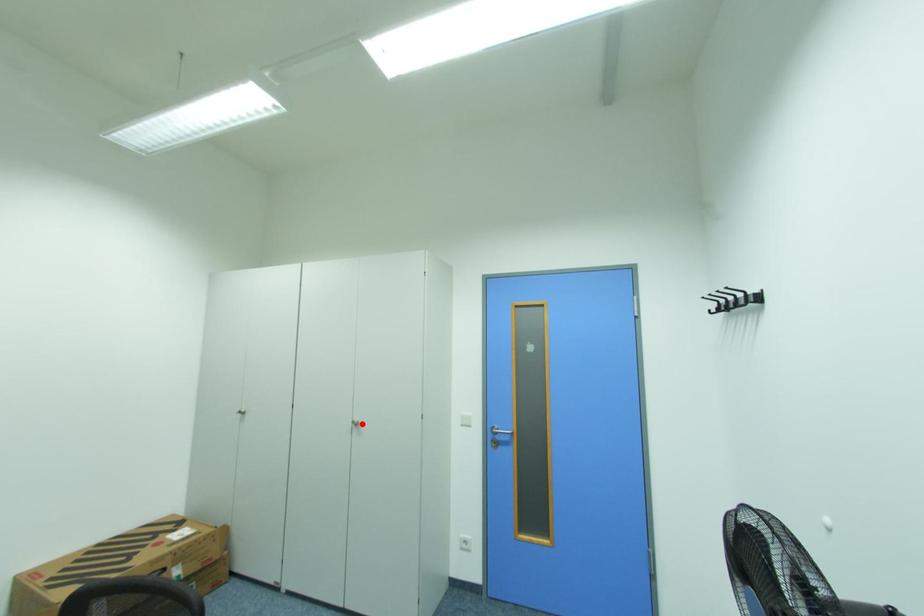
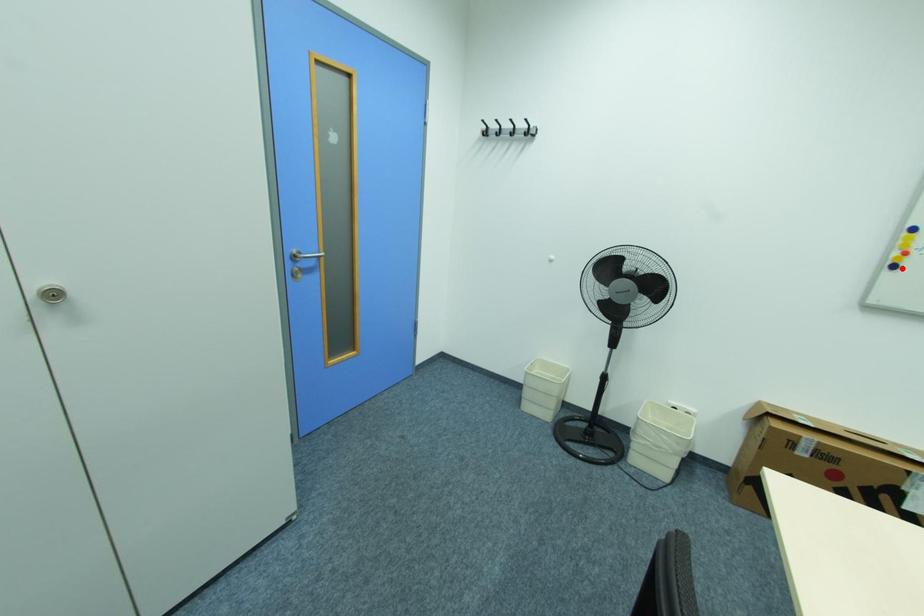
I am providing you with two images of the same scene from different viewpoints. A red point is marked on the first image and another point is marked on the second image. Are the points marked in image1 and image2 representing the same 3D position?

No